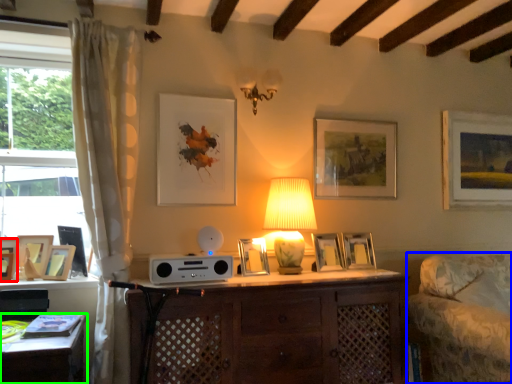
Question: Estimate the real-world distances between objects in this image. Which object is closer to picture frame (highlighted by a red box), swivel chair (highlighted by a blue box) or desk (highlighted by a green box)?

Choices:
 (A) swivel chair
 (B) desk

Answer: (B)